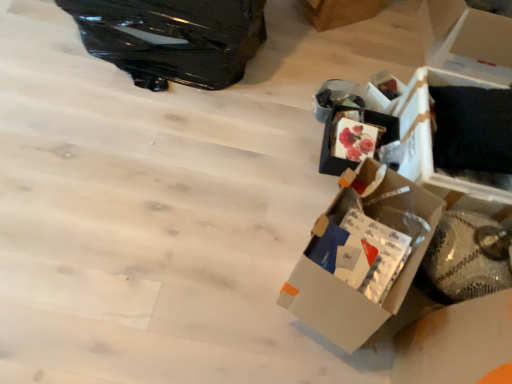
Question: Is glossy black suitcase at upper left in front of or behind black cardboard box at right, placed as the 1th storage box when sorted from front to back, in the image?

Choices:
 (A) behind
 (B) front

Answer: (A)

Question: Considering the positions of point (182, 16) and point (497, 190), is point (182, 16) closer or farther from the camera than point (497, 190)?

Choices:
 (A) farther
 (B) closer

Answer: (A)

Question: Estimate the real-world distances between objects in this image. Which object is closer to the glossy black suitcase at upper left?

Choices:
 (A) white cardboard box at upper right, which is the first cardboard box from left to right
 (B) white cardboard box at upper right, arranged as the 1th storage box when viewed from the back
 (C) white cardboard box at upper right, the first cardboard box when ordered from right to left
 (D) white cardboard box at center-right
 (E) black cardboard box at right, arranged as the 2th storage box when viewed from the back

Answer: (A)

Question: Based on their relative distances, which object is farther from the glossy black suitcase at upper left?

Choices:
 (A) white cardboard box at center-right
 (B) white cardboard box at upper right, arranged as the 1th storage box when viewed from the back
 (C) white cardboard box at upper right, placed as the second cardboard box when sorted from left to right
 (D) white cardboard box at upper right, which is the first cardboard box from left to right
 (E) black cardboard box at right, placed as the 1th storage box when sorted from front to back

Answer: (C)